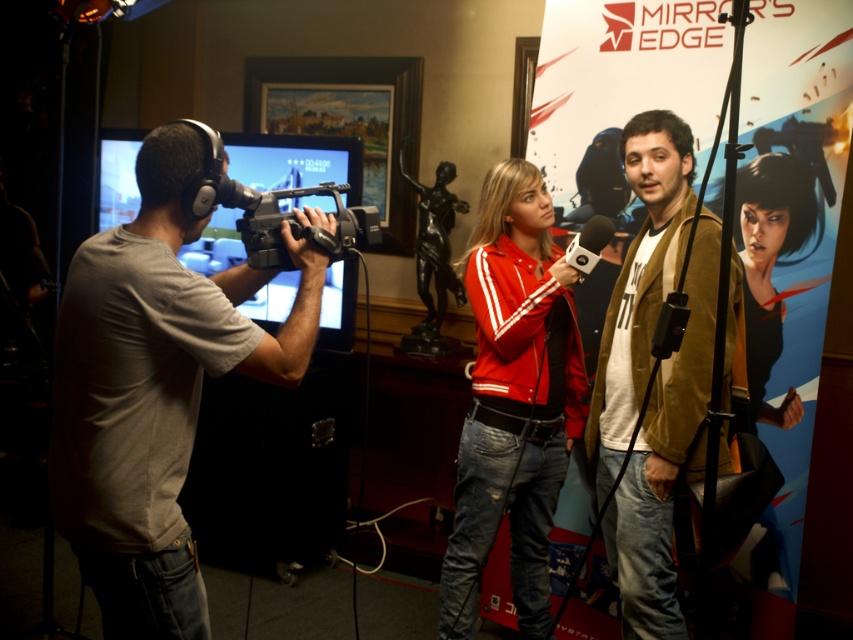
You are an event coordinator at the Mirror Edge promotional event. You need to adjust the camera angle so that both the blue glossy poster at center right and the black matte microphone at center are visible in the frame. Based on their positions, where should you position the camera?

The blue glossy poster at center right is below the black matte microphone at center. To include both in the frame, position the camera so it can capture the lower area where the poster is located while still framing the microphone above it.

You are an event organizer who needs to determine clothing sizes for participants. You see the gray fabric shirt at left and the brown textured jacket at center in the image. Which clothing item is larger in size?

The gray fabric shirt at left is bigger than the brown textured jacket at center, so the gray fabric shirt at left is the larger clothing item.

You are an event organizer who needs to adjust the placement of the blue glossy poster at center right and the matte red jacket at center for better visibility. According to the current setup, which object is located to the right of the other?

The blue glossy poster at center right is positioned on the right side of the matte red jacket at center, so the blue glossy poster at center right is to the right of the matte red jacket at center.